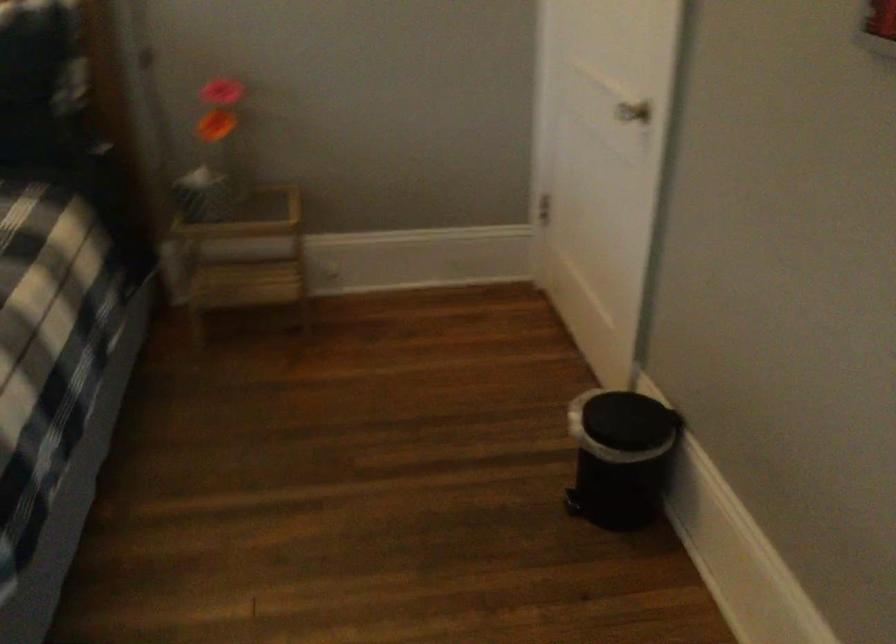
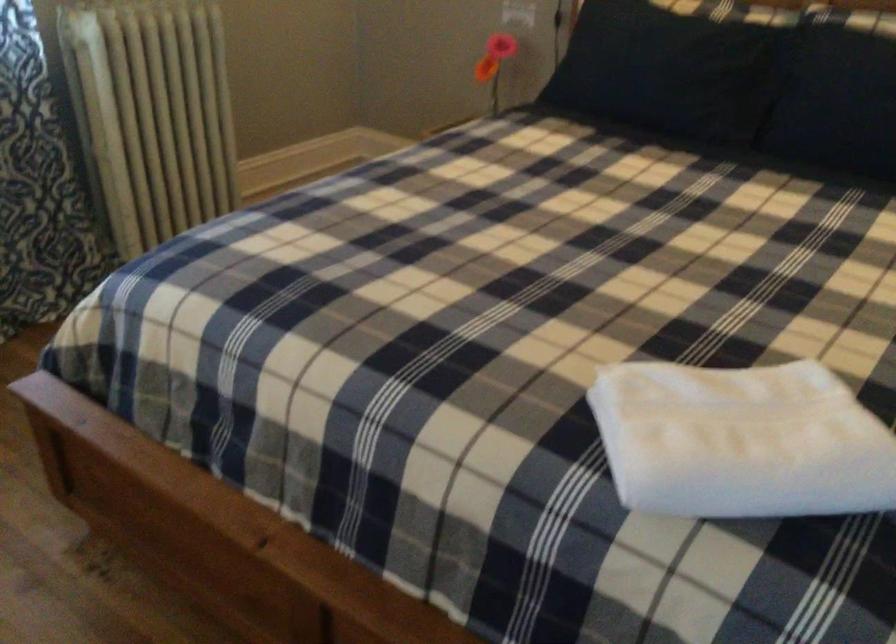
Question: The camera is either moving clockwise (left) or counter-clockwise (right) around the object. The first image is from the beginning of the video and the second image is from the end. Is the camera moving left or right when shooting the video?

Choices:
 (A) Left
 (B) Right

Answer: (B)